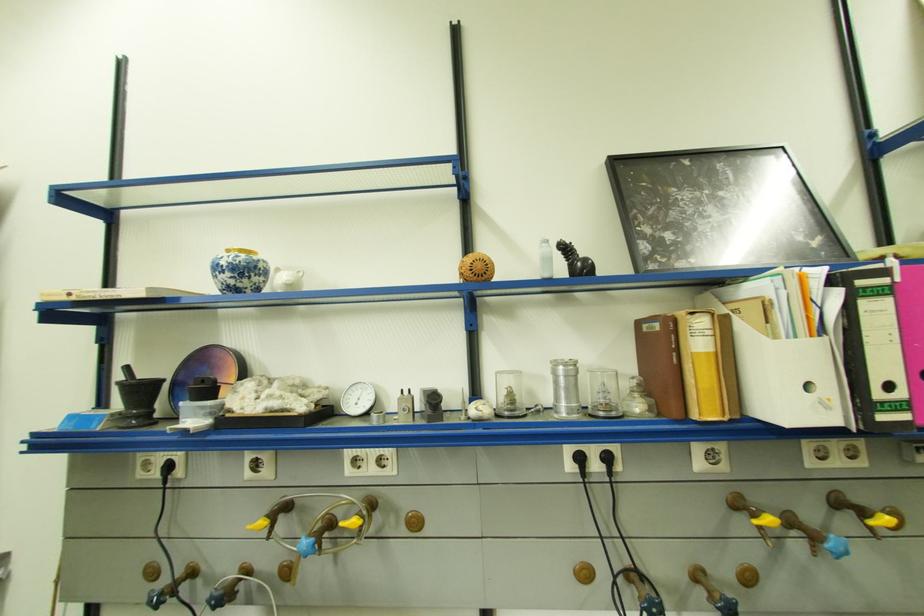
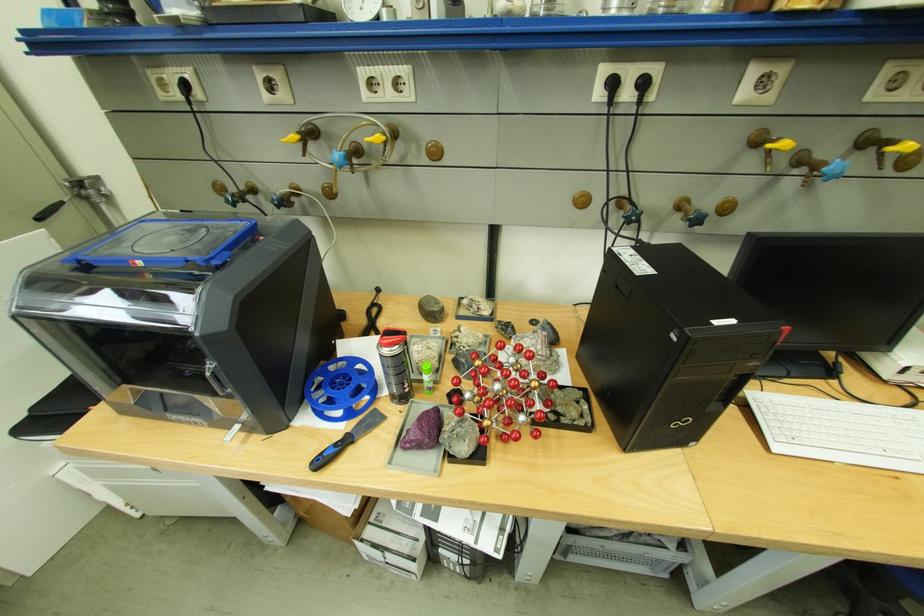
Find the pixel in the second image that matches point (706, 582) in the first image.

(688, 208)